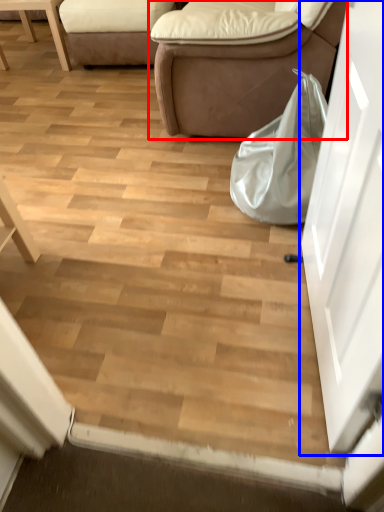
Question: Which of the following is the farthest to the observer, studio couch (highlighted by a red box) or door (highlighted by a blue box)?

Choices:
 (A) studio couch
 (B) door

Answer: (A)